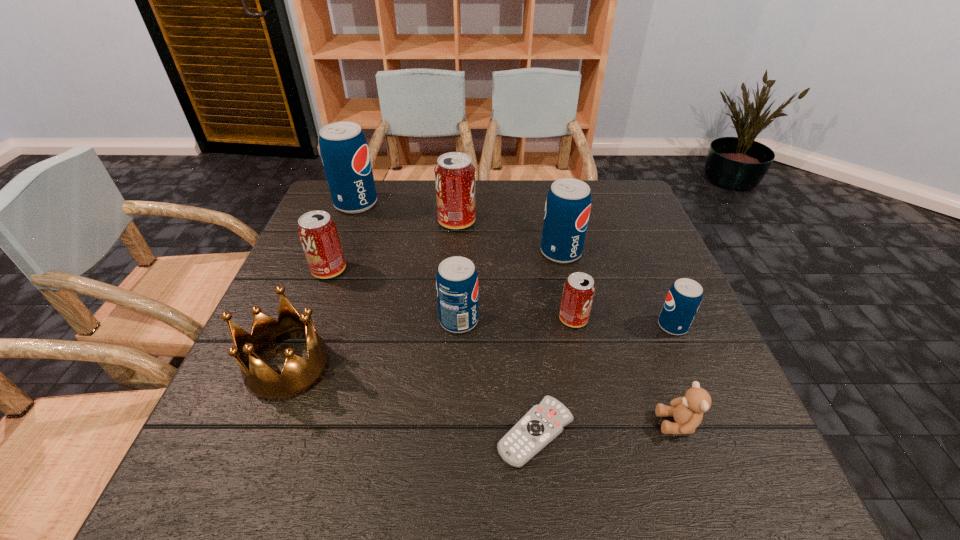
The height and width of the screenshot is (540, 960). I want to click on the nearest red soda can, so 579,289.

You are a GUI agent. You are given a task and a screenshot of the screen. Output one action in this format:
    pyautogui.click(x=<x>, y=<y>)
    Task: Click on the rightmost red soda can
    The image size is (960, 540).
    Given the screenshot: What is the action you would take?
    pyautogui.click(x=579, y=289)

Identify the location of the rightmost pop. This screenshot has height=540, width=960. (684, 297).

Find the location of a particular element. the smallest blue pop is located at coordinates (684, 297).

Identify the location of brown teddy bear. The height and width of the screenshot is (540, 960). coord(687,411).

At what (x,y) coordinates should I click in order to perform the action: click on the second shortest object. Please return your answer as a coordinate pair (x, y). The height and width of the screenshot is (540, 960). Looking at the image, I should click on [687, 411].

This screenshot has height=540, width=960. Identify the location of remote control. (542, 423).

Where is `vacant space located on the front of the farthest blue pop`? This screenshot has height=540, width=960. vacant space located on the front of the farthest blue pop is located at coordinates (317, 307).

Where is `vacant area situated on the front of the second farthest blue pop`? vacant area situated on the front of the second farthest blue pop is located at coordinates (588, 373).

Locate an element on the screen. The image size is (960, 540). vacant space positioned 0.170m on the left of the biggest red soda can is located at coordinates (379, 222).